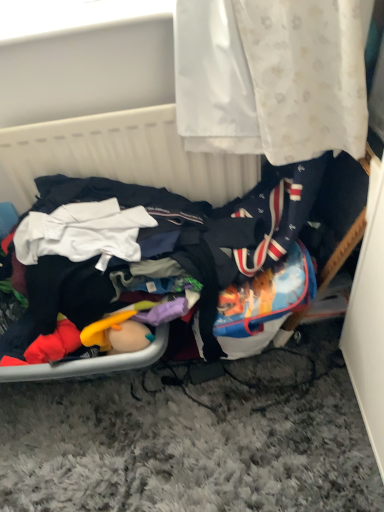
Question: Considering the positions of multicolored fabric pile at lower left and white fabric basket at upper center in the image, is multicolored fabric pile at lower left wider or thinner than white fabric basket at upper center?

Choices:
 (A) thin
 (B) wide

Answer: (B)

Question: Does point pos(77,303) appear closer or farther from the camera than point pos(115,145)?

Choices:
 (A) closer
 (B) farther

Answer: (A)

Question: Is multicolored fabric pile at lower left inside the boundaries of white fabric basket at upper center, or outside?

Choices:
 (A) inside
 (B) outside

Answer: (B)

Question: In terms of size, does white fabric basket at upper center appear bigger or smaller than multicolored fabric pile at lower left?

Choices:
 (A) small
 (B) big

Answer: (A)

Question: Visually, is white fabric basket at upper center positioned to the left or to the right of multicolored fabric pile at lower left?

Choices:
 (A) right
 (B) left

Answer: (B)

Question: From the image's perspective, is white fabric basket at upper center positioned above or below multicolored fabric pile at lower left?

Choices:
 (A) above
 (B) below

Answer: (A)

Question: Which is correct: white fabric basket at upper center is inside multicolored fabric pile at lower left, or outside of it?

Choices:
 (A) outside
 (B) inside

Answer: (A)